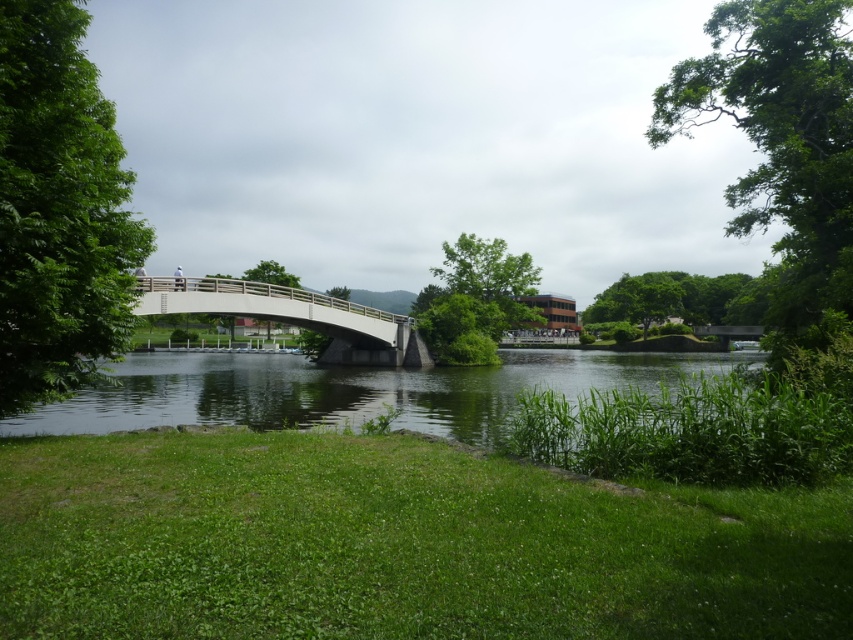
You are planning to build a small garden on the green grassy lake at center and the white concrete bridge at center. Which location would be more suitable for planting flowers, and why?

The green grassy lake at center is more suitable for planting flowers because it has a larger size compared to the white concrete bridge at center, providing more space for the garden.

You are standing on the white pedestrian bridge and want to walk towards the point that is closer to you. Which point should you walk towards, point (99,420) or point (132,310)?

You should walk towards point (99,420) because it is further to the viewer than point (132,310), meaning it is closer to your current position on the bridge.